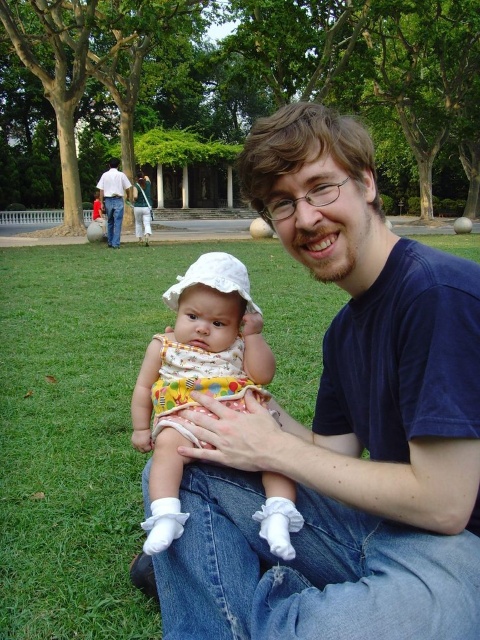
Can you confirm if printed cotton dress at center is shorter than denim jeans at center?

Indeed, printed cotton dress at center has a lesser height compared to denim jeans at center.

Find the location of `printed cotton dress at center`. printed cotton dress at center is located at coordinates (192, 376).

I want to click on printed cotton dress at center, so [x=192, y=376].

Consider the image. Does blue cotton shirt at center have a lesser width compared to printed cotton dress at center?

In fact, blue cotton shirt at center might be wider than printed cotton dress at center.

Between blue cotton shirt at center and printed cotton dress at center, which one is positioned higher?

blue cotton shirt at center is higher up.

Which is in front, point (316, 568) or point (175, 536)?

Positioned in front is point (175, 536).

Identify the location of blue cotton shirt at center. (343, 426).

Can you confirm if blue cotton shirt at center is bigger than denim jeans at center?

No.

You are a GUI agent. You are given a task and a screenshot of the screen. Output one action in this format:
    pyautogui.click(x=<x>, y=<y>)
    Task: Click on the blue cotton shirt at center
    
    Given the screenshot: What is the action you would take?
    pyautogui.click(x=343, y=426)

Identify the location of blue cotton shirt at center. This screenshot has width=480, height=640. (343, 426).